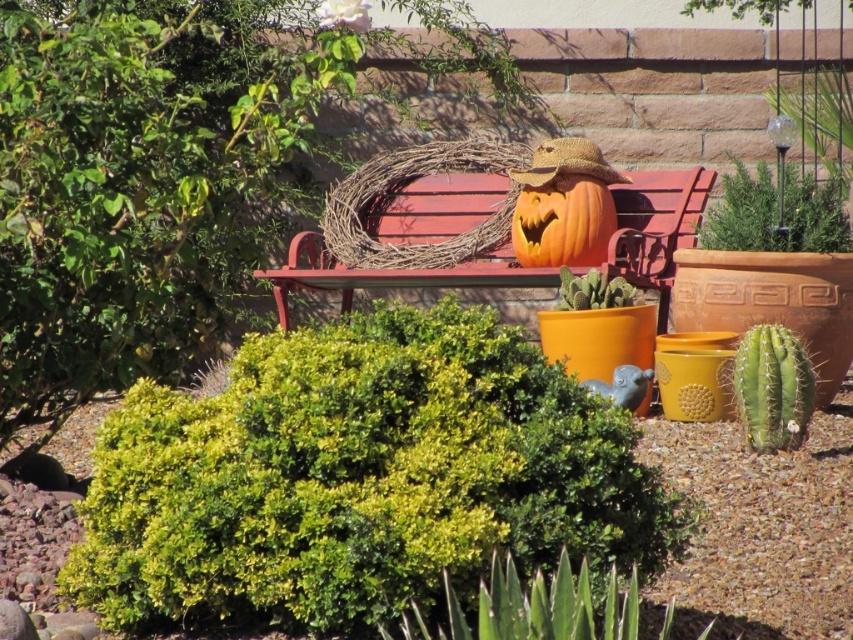
You are standing at the origin point of the garden scene. You want to place a new decorative item at the same location as the green leafy bush at center. What are the coordinates you should aim for?

The coordinates for the green leafy bush at center are at point (361, 477). So you should aim for those coordinates.

You are a small squirrel trying to reach the top of the orange matte pumpkin at center to hide an acorn. Can you climb the wooden bench at center to get there?

The wooden bench at center is taller than the orange matte pumpkin at center, so yes, the squirrel can climb the wooden bench at center to reach the top of the orange matte pumpkin at center.

You are standing in the garden and want to water the green leafy bush at center. If your watering can has a range of 3 meters, can you water it without moving closer?

The green leafy bush at center is 3.73 meters away from the viewer, which is beyond the watering can range of 3 meters. You need to move closer to water it.